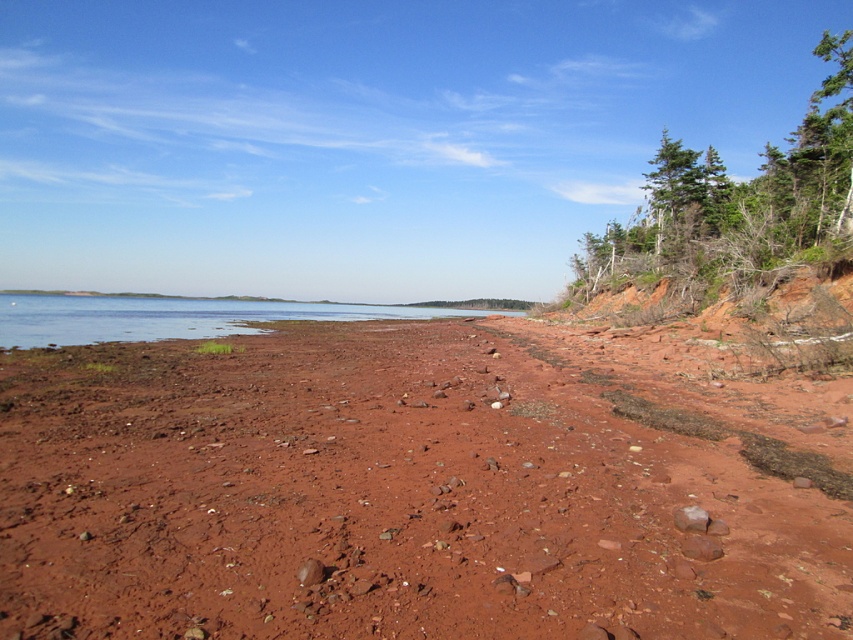
Is reddish-brown gravel at center smaller than green leafy trees at upper right?

Yes, reddish-brown gravel at center is smaller than green leafy trees at upper right.

Describe the element at coordinates (410, 486) in the screenshot. I see `reddish-brown gravel at center` at that location.

Does point (61, 352) lie behind point (816, 257)?

No, it is not.

The width and height of the screenshot is (853, 640). I want to click on reddish-brown gravel at center, so click(410, 486).

Locate an element on the screen. The height and width of the screenshot is (640, 853). reddish-brown gravel at center is located at coordinates (410, 486).

Locate an element on the screen. The image size is (853, 640). reddish-brown gravel at center is located at coordinates (410, 486).

Find the location of a particular element. Image resolution: width=853 pixels, height=640 pixels. reddish-brown gravel at center is located at coordinates (410, 486).

Who is more forward, (679, 193) or (96, 305)?

Point (679, 193) is in front.

Between green leafy trees at upper right and clear water at center, which one is positioned lower?

clear water at center is below.

The width and height of the screenshot is (853, 640). I want to click on green leafy trees at upper right, so click(x=738, y=205).

What are the coordinates of `green leafy trees at upper right` in the screenshot? It's located at (738, 205).